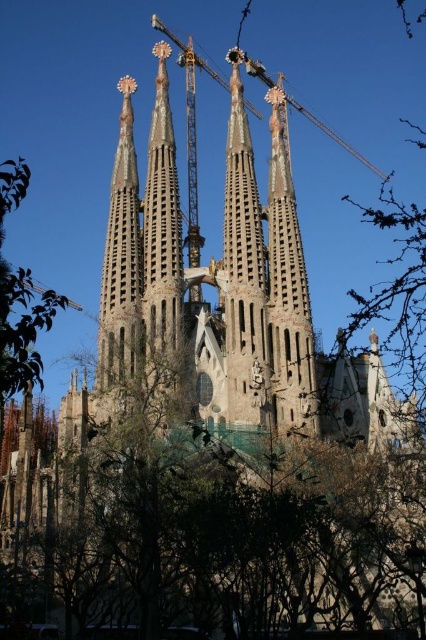
Between rustic stone tower at center and metallic gray crane at upper center, which one appears on the right side from the viewer's perspective?

Result: metallic gray crane at upper center is more to the right.

This screenshot has width=426, height=640. Describe the element at coordinates (244, 272) in the screenshot. I see `rustic stone tower at center` at that location.

I want to click on rustic stone tower at center, so click(244, 272).

Does point (236, 225) lie in front of point (17, 342)?

No, it is not.

Is rustic stone tower at center to the left of green leafy tree at left from the viewer's perspective?

Incorrect, rustic stone tower at center is not on the left side of green leafy tree at left.

Who is more distant from viewer, (229, 214) or (28, 292)?

Positioned behind is point (229, 214).

Where is `rustic stone tower at center`? Image resolution: width=426 pixels, height=640 pixels. rustic stone tower at center is located at coordinates (244, 272).

Is green leafy tree at left to the left of metallic gray crane at upper center from the viewer's perspective?

Correct, you'll find green leafy tree at left to the left of metallic gray crane at upper center.

Measure the distance between green leafy tree at left and camera.

green leafy tree at left and camera are 53.80 meters apart.

Describe the element at coordinates (20, 298) in the screenshot. I see `green leafy tree at left` at that location.

Find the location of a particular element. This screenshot has width=426, height=640. green leafy tree at left is located at coordinates (20, 298).